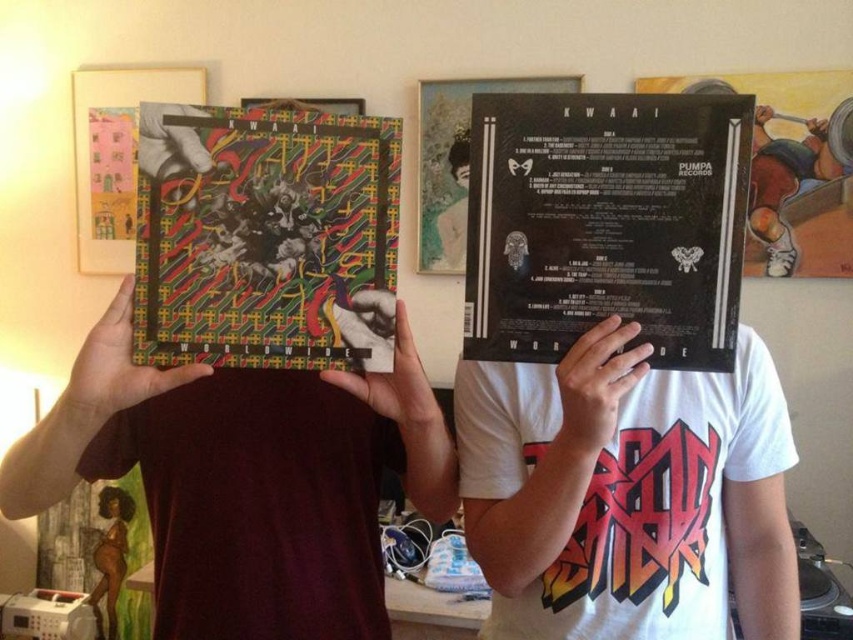
Question: Based on their relative distances, which object is nearer to the black matte vinyl record at center?

Choices:
 (A) smooth brown hair at center
 (B) multicolored paper art at center
 (C) matte black hair at center

Answer: (B)

Question: Is the position of multicolored paper art at center less distant than that of matte black hair at center?

Choices:
 (A) yes
 (B) no

Answer: (A)

Question: Which point appears farthest from the camera in this image?

Choices:
 (A) (465, 186)
 (B) (717, 280)
 (C) (131, 509)

Answer: (C)

Question: Which of the following is the farthest from the observer?

Choices:
 (A) multicolored paper art at center
 (B) matte black hair at center
 (C) smooth brown hair at center

Answer: (C)

Question: Does black matte vinyl record at center appear over matte black hair at center?

Choices:
 (A) yes
 (B) no

Answer: (B)

Question: Can you confirm if smooth brown hair at center is bigger than matte black hair at center?

Choices:
 (A) yes
 (B) no

Answer: (A)